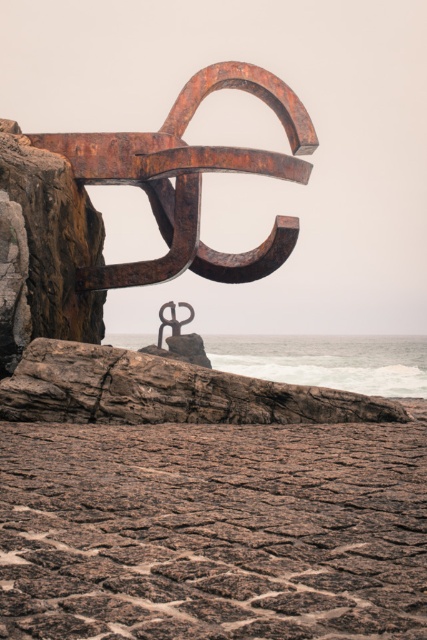
Is rusty stone beach at lower center shorter than rusty metal anchor at center?

Indeed, rusty stone beach at lower center has a lesser height compared to rusty metal anchor at center.

Does point (108, 506) come in front of point (85, 140)?

Yes, it is in front of point (85, 140).

At what (x,y) coordinates should I click in order to perform the action: click on rusty stone beach at lower center. Please return your answer as a coordinate pair (x, y). Looking at the image, I should click on (213, 531).